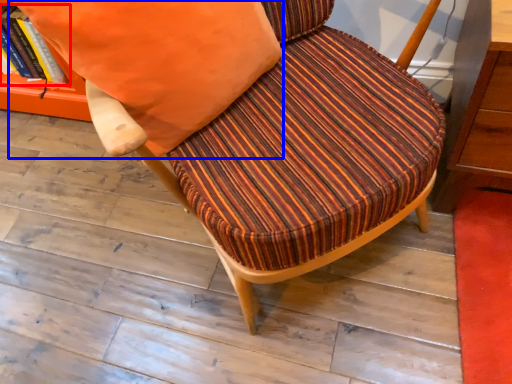
Question: Which of the following is the closest to the observer, book (highlighted by a red box) or throw pillow (highlighted by a blue box)?

Choices:
 (A) book
 (B) throw pillow

Answer: (B)